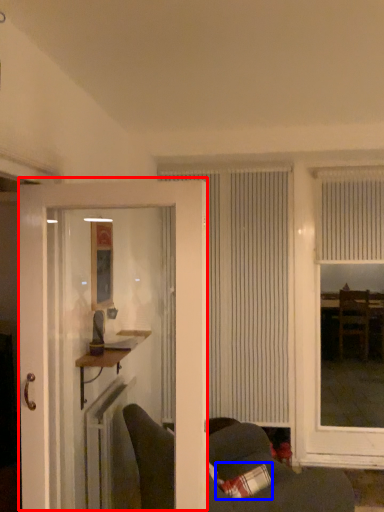
Question: Which of the following is the closest to the observer, door (highlighted by a red box) or pillow (highlighted by a blue box)?

Choices:
 (A) door
 (B) pillow

Answer: (A)